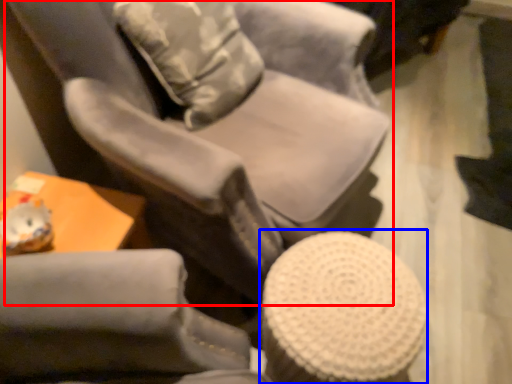
Question: Which object is further to the camera taking this photo, chair (highlighted by a red box) or bar stool (highlighted by a blue box)?

Choices:
 (A) chair
 (B) bar stool

Answer: (B)